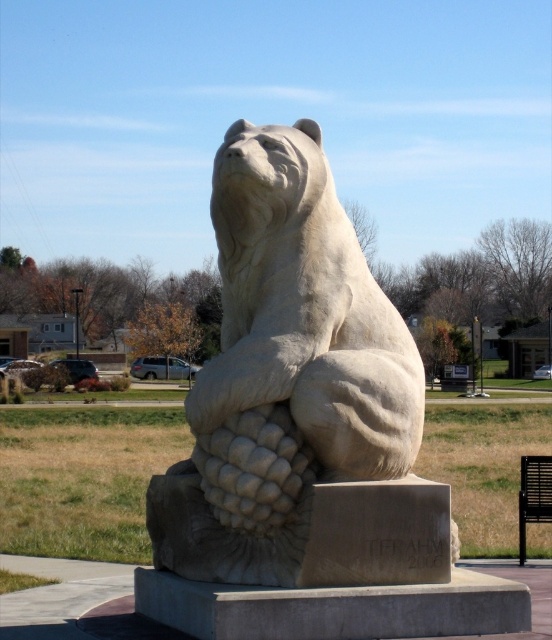
Does white stone bear at center have a lesser width compared to black metal park bench at lower right?

No.

Does white stone bear at center have a smaller size compared to black metal park bench at lower right?

Incorrect, white stone bear at center is not smaller in size than black metal park bench at lower right.

Is point (408, 396) more distant than point (524, 477)?

That is False.

Locate an element on the screen. The image size is (552, 640). white stone bear at center is located at coordinates (299, 396).